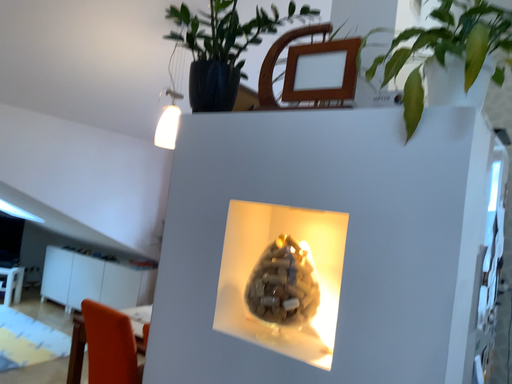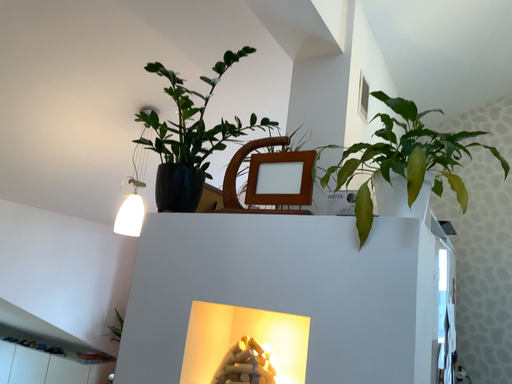
Question: Which way did the camera rotate in the video?

Choices:
 (A) rotated upward
 (B) rotated downward

Answer: (A)